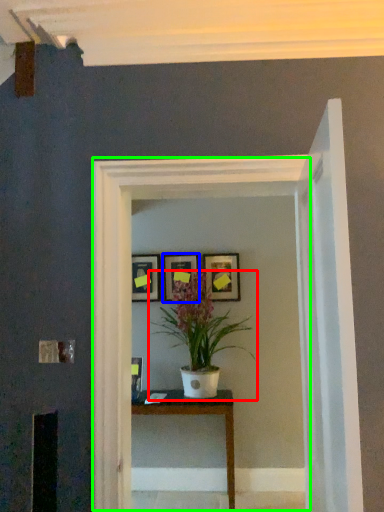
Question: Which object is the closest to the houseplant (highlighted by a red box)? Choose among these: picture frame (highlighted by a blue box) or glass door (highlighted by a green box).

Choices:
 (A) picture frame
 (B) glass door

Answer: (A)